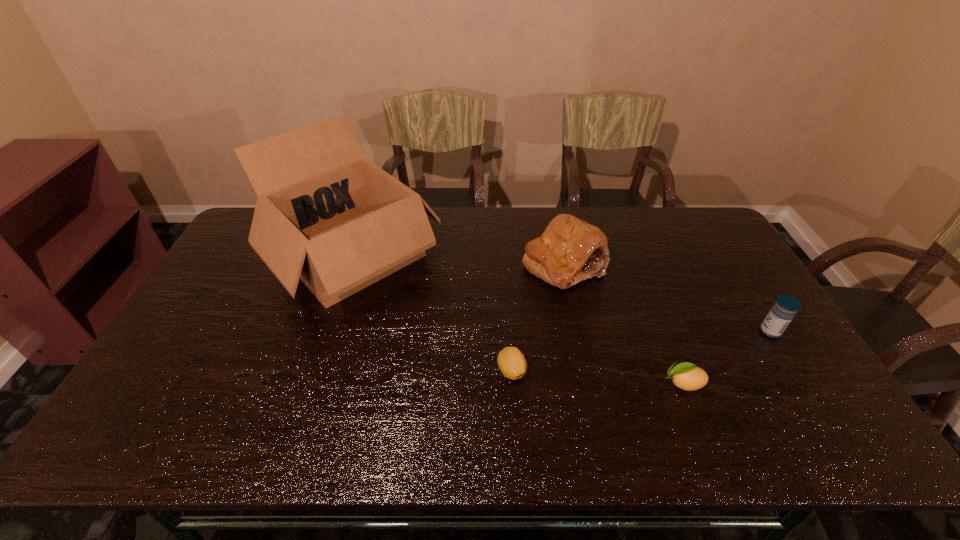
In order to click on blank space at the far edge of the desktop in this screenshot , I will do `click(584, 211)`.

At what (x,y) coordinates should I click in order to perform the action: click on vacant space at the near edge of the desktop. Please return your answer as a coordinate pair (x, y). The height and width of the screenshot is (540, 960). Looking at the image, I should click on (228, 418).

Where is `vacant area at the right edge`? This screenshot has height=540, width=960. vacant area at the right edge is located at coordinates (756, 288).

The image size is (960, 540). I want to click on vacant region at the far right corner of the desktop, so click(671, 226).

This screenshot has width=960, height=540. In order to click on vacant space at the near right corner in this screenshot , I will do `click(790, 417)`.

Where is `free space between the left lemon and the third object from right to left`? This screenshot has width=960, height=540. free space between the left lemon and the third object from right to left is located at coordinates (538, 318).

The height and width of the screenshot is (540, 960). I want to click on vacant space that is in between the third farthest object and the second object from left to right, so click(640, 351).

Find the location of a particular element. This screenshot has width=960, height=540. free spot between the bread and the medicine is located at coordinates (667, 298).

Locate an element on the screen. free space between the bread and the left lemon is located at coordinates (538, 318).

At what (x,y) coordinates should I click in order to perform the action: click on empty location between the fourth object from right to left and the fourth object from left to right. Please return your answer as a coordinate pair (x, y). Looking at the image, I should click on (597, 377).